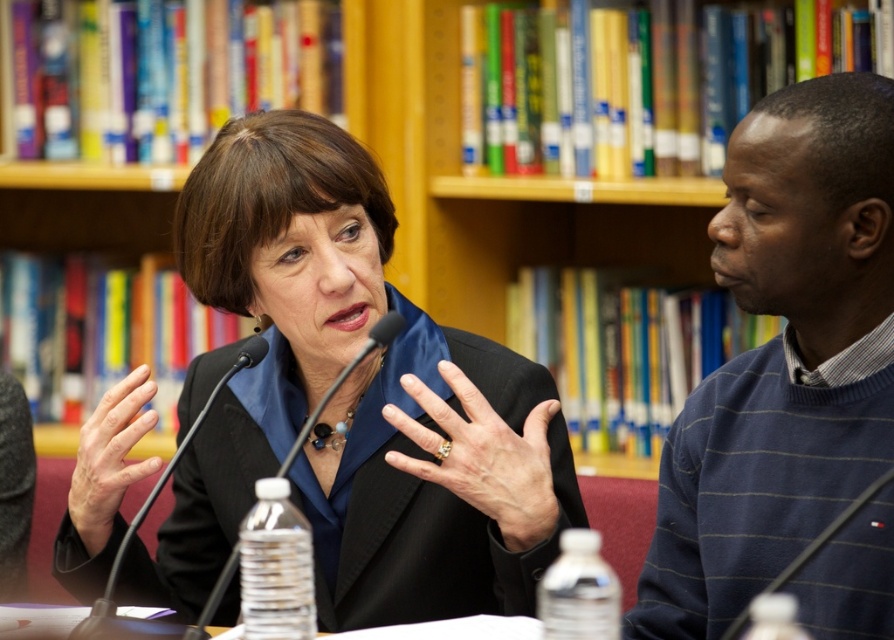
Question: Can you confirm if black matte suit at center is positioned to the left of black plastic microphone at center?

Choices:
 (A) no
 (B) yes

Answer: (A)

Question: Which object appears closest to the camera in this image?

Choices:
 (A) blue striped sweater at right
 (B) black plastic microphone at center

Answer: (A)

Question: Estimate the real-world distances between objects in this image. Which object is closer to the blue striped sweater at right?

Choices:
 (A) black matte microphone at center
 (B) black matte suit at center

Answer: (B)

Question: Which point appears farthest from the camera in this image?

Choices:
 (A) (444, 333)
 (B) (195, 637)
 (C) (844, 472)

Answer: (A)

Question: Does blue striped sweater at right appear on the right side of black plastic microphone at center?

Choices:
 (A) no
 (B) yes

Answer: (B)

Question: Is blue striped sweater at right positioned at the back of black plastic microphone at center?

Choices:
 (A) no
 (B) yes

Answer: (A)